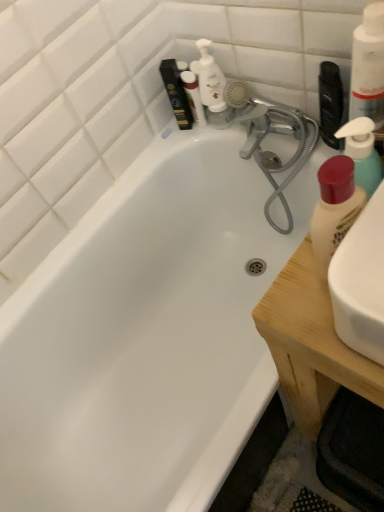
This screenshot has width=384, height=512. What do you see at coordinates (362, 153) in the screenshot? I see `translucent plastic pump bottle at right, marked as the second cleaning product in a top-to-bottom arrangement` at bounding box center [362, 153].

What do you see at coordinates (334, 208) in the screenshot?
I see `matte white lotion at right, which is the third cleaning product from top to bottom` at bounding box center [334, 208].

Identify the location of matte white lotion at right, which is the third cleaning product from top to bottom. (334, 208).

The image size is (384, 512). I want to click on white pump bottle at upper right, the 3th cleaning product from the bottom, so click(368, 67).

The height and width of the screenshot is (512, 384). Describe the element at coordinates (368, 67) in the screenshot. I see `white pump bottle at upper right, the 3th cleaning product from the bottom` at that location.

Identify the location of white plastic pump bottle at upper center. (193, 97).

What do you see at coordinates (311, 344) in the screenshot?
I see `wooden at right` at bounding box center [311, 344].

The image size is (384, 512). Find the location of `translucent plastic pump bottle at right, which is counted as the 2th cleaning product, starting from the bottom`. translucent plastic pump bottle at right, which is counted as the 2th cleaning product, starting from the bottom is located at coordinates (x=362, y=153).

From the image's perspective, which is below, white pump bottle at upper right, which is the first cleaning product from top to bottom, or white plastic pump bottle at upper center?

white pump bottle at upper right, which is the first cleaning product from top to bottom, is shown below in the image.

Is white pump bottle at upper right, the 3th cleaning product from the bottom, in front of or behind white plastic pump bottle at upper center in the image?

white pump bottle at upper right, the 3th cleaning product from the bottom, is in front of white plastic pump bottle at upper center.

Is white pump bottle at upper right, the 3th cleaning product from the bottom, facing towards white plastic pump bottle at upper center?

No, white pump bottle at upper right, the 3th cleaning product from the bottom, is not aimed at white plastic pump bottle at upper center.

Is point (367, 23) farther from camera compared to point (203, 121)?

No, it is in front of (203, 121).

From a real-world perspective, is wooden at right physically above white plastic pump bottle at upper center?

No, from a real-world perspective, wooden at right is not on top of white plastic pump bottle at upper center.

Looking at this image, who is bigger, wooden at right or white plastic pump bottle at upper center?

wooden at right.

Does wooden at right have a greater height compared to white plastic pump bottle at upper center?

Yes.

Which is behind, translucent plastic pump bottle at right, which is counted as the 2th cleaning product, starting from the bottom, or white pump bottle at upper right, the 3th cleaning product from the bottom?

translucent plastic pump bottle at right, which is counted as the 2th cleaning product, starting from the bottom, is further from the camera.

Between point (359, 186) and point (357, 110), which one is positioned in front?

The point (359, 186) is more forward.

Is translucent plastic pump bottle at right, marked as the second cleaning product in a top-to-bottom arrangement, taller or shorter than white pump bottle at upper right, which is the first cleaning product from top to bottom?

translucent plastic pump bottle at right, marked as the second cleaning product in a top-to-bottom arrangement, is shorter than white pump bottle at upper right, which is the first cleaning product from top to bottom.

From the image's perspective, is translucent plastic pump bottle at right, which is counted as the 2th cleaning product, starting from the bottom, on top of white pump bottle at upper right, the 3th cleaning product from the bottom?

No, from the image's perspective, translucent plastic pump bottle at right, which is counted as the 2th cleaning product, starting from the bottom, is not over white pump bottle at upper right, the 3th cleaning product from the bottom.

Is white plastic pump bottle at upper center not within white pump bottle at upper right, which is the first cleaning product from top to bottom?

Yes, white plastic pump bottle at upper center is not within white pump bottle at upper right, which is the first cleaning product from top to bottom.

From the image's perspective, count 1st cleaning products downward from the white plastic pump bottle at upper center and point to it. Please provide its 2D coordinates.

[(368, 67)]

Who is smaller, white plastic pump bottle at upper center or white pump bottle at upper right, the 3th cleaning product from the bottom?

Smaller between the two is white plastic pump bottle at upper center.

From a real-world perspective, is white plastic pump bottle at upper center positioned above or below white pump bottle at upper right, which is the first cleaning product from top to bottom?

From a real-world perspective, white plastic pump bottle at upper center is physically below white pump bottle at upper right, which is the first cleaning product from top to bottom.

Would you say wooden at right is part of white plastic pump bottle at upper center's contents?

No, wooden at right is not a part of white plastic pump bottle at upper center.

From the image's perspective, which object appears higher, white plastic pump bottle at upper center or wooden at right?

white plastic pump bottle at upper center.

From a real-world perspective, which is physically above, white plastic pump bottle at upper center or wooden at right?

From a 3D spatial view, white plastic pump bottle at upper center is above.

Looking at this image, is white plastic pump bottle at upper center next to wooden at right?

white plastic pump bottle at upper center and wooden at right are clearly separated.

Is translucent plastic pump bottle at right, which is counted as the 2th cleaning product, starting from the bottom, facing towards white plastic pump bottle at upper center?

No, translucent plastic pump bottle at right, which is counted as the 2th cleaning product, starting from the bottom, does not turn towards white plastic pump bottle at upper center.

From the image's perspective, relative to white plastic pump bottle at upper center, is translucent plastic pump bottle at right, marked as the second cleaning product in a top-to-bottom arrangement, above or below?

translucent plastic pump bottle at right, marked as the second cleaning product in a top-to-bottom arrangement, is below white plastic pump bottle at upper center.

Is translucent plastic pump bottle at right, marked as the second cleaning product in a top-to-bottom arrangement, positioned beyond the bounds of white plastic pump bottle at upper center?

Yes, translucent plastic pump bottle at right, marked as the second cleaning product in a top-to-bottom arrangement, is outside of white plastic pump bottle at upper center.

From the image's perspective, is white pump bottle at upper right, the 3th cleaning product from the bottom, above or below wooden at right?

white pump bottle at upper right, the 3th cleaning product from the bottom, is situated higher than wooden at right in the image.

Is white pump bottle at upper right, which is the first cleaning product from top to bottom, in contact with wooden at right?

They are not placed beside each other.

Considering the relative positions of white pump bottle at upper right, the 3th cleaning product from the bottom, and wooden at right in the image provided, is white pump bottle at upper right, the 3th cleaning product from the bottom, to the left or to the right of wooden at right?

white pump bottle at upper right, the 3th cleaning product from the bottom, is positioned on wooden at right's left side.

Identify the location of counter top below the white pump bottle at upper right, which is the first cleaning product from top to bottom (from a real-world perspective). (311, 344).

From the image's perspective, count 1st cleaning products downward from the white plastic pump bottle at upper center and point to it. Please provide its 2D coordinates.

[(368, 67)]

Where is `toiletry behind the wooden at right`? toiletry behind the wooden at right is located at coordinates (193, 97).

When comparing their distances from matte white lotion at right, which is the third cleaning product from top to bottom, does translucent plastic pump bottle at right, which is counted as the 2th cleaning product, starting from the bottom, or white plastic pump bottle at upper center seem closer?

translucent plastic pump bottle at right, which is counted as the 2th cleaning product, starting from the bottom, is positioned closer to the anchor matte white lotion at right, which is the third cleaning product from top to bottom.

Looking at the image, which one is located further to translucent plastic pump bottle at right, which is counted as the 2th cleaning product, starting from the bottom, matte white lotion at right, which is the third cleaning product from top to bottom, or white pump bottle at upper right, which is the first cleaning product from top to bottom?

white pump bottle at upper right, which is the first cleaning product from top to bottom.

When comparing their distances from white pump bottle at upper right, the 3th cleaning product from the bottom, does white plastic pump bottle at upper center or translucent plastic pump bottle at right, marked as the second cleaning product in a top-to-bottom arrangement, seem further?

The object further to white pump bottle at upper right, the 3th cleaning product from the bottom, is white plastic pump bottle at upper center.

Which object lies further to the anchor point matte white lotion at right, which is the third cleaning product from top to bottom, translucent plastic pump bottle at right, marked as the second cleaning product in a top-to-bottom arrangement, or white pump bottle at upper right, the 3th cleaning product from the bottom?

The object further to matte white lotion at right, which is the third cleaning product from top to bottom, is white pump bottle at upper right, the 3th cleaning product from the bottom.

Based on their spatial positions, is white pump bottle at upper right, which is the first cleaning product from top to bottom, or matte white lotion at right, which appears as the first cleaning product when ordered from the bottom, further from wooden at right?

white pump bottle at upper right, which is the first cleaning product from top to bottom, is further to wooden at right.

Estimate the real-world distances between objects in this image. Which object is closer to wooden at right, matte white lotion at right, which appears as the first cleaning product when ordered from the bottom, or translucent plastic pump bottle at right, which is counted as the 2th cleaning product, starting from the bottom?

Based on the image, matte white lotion at right, which appears as the first cleaning product when ordered from the bottom, appears to be nearer to wooden at right.

Looking at the image, which one is located further to matte white lotion at right, which is the third cleaning product from top to bottom, white pump bottle at upper right, the 3th cleaning product from the bottom, or white plastic pump bottle at upper center?

white plastic pump bottle at upper center.

When comparing their distances from white pump bottle at upper right, which is the first cleaning product from top to bottom, does white plastic pump bottle at upper center or matte white lotion at right, which appears as the first cleaning product when ordered from the bottom, seem further?

white plastic pump bottle at upper center lies further to white pump bottle at upper right, which is the first cleaning product from top to bottom, than the other object.

The height and width of the screenshot is (512, 384). I want to click on counter top between white pump bottle at upper right, the 3th cleaning product from the bottom, and white plastic pump bottle at upper center from front to back, so click(311, 344).

Where is `counter top between translucent plastic pump bottle at right, which is counted as the 2th cleaning product, starting from the bottom, and white plastic pump bottle at upper center in the front-back direction`? counter top between translucent plastic pump bottle at right, which is counted as the 2th cleaning product, starting from the bottom, and white plastic pump bottle at upper center in the front-back direction is located at coordinates (311, 344).

This screenshot has width=384, height=512. I want to click on counter top between matte white lotion at right, which appears as the first cleaning product when ordered from the bottom, and white plastic pump bottle at upper center, along the z-axis, so click(x=311, y=344).

Locate an element on the screen. Image resolution: width=384 pixels, height=512 pixels. cleaning product between white pump bottle at upper right, which is the first cleaning product from top to bottom, and white plastic pump bottle at upper center, along the z-axis is located at coordinates (362, 153).